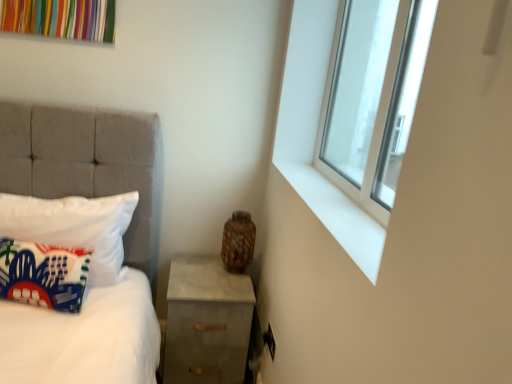
Question: Is clear glass window at upper right in front of or behind white fabric pillow at left, arranged as the second pillow when viewed from the front, in the image?

Choices:
 (A) front
 (B) behind

Answer: (A)

Question: In terms of width, does clear glass window at upper right look wider or thinner when compared to white fabric pillow at left, arranged as the second pillow when viewed from the front?

Choices:
 (A) thin
 (B) wide

Answer: (A)

Question: Which object is positioned farthest from the clear glass window at upper right?

Choices:
 (A) concrete nightstand at lower right
 (B) printed fabric pillow at left, the second pillow when ordered from back to front
 (C) white fabric pillow at left, which is the 1th pillow from back to front
 (D) brown textured vase at lower right
 (E) white smooth window sill at upper right

Answer: (B)

Question: Estimate the real-world distances between objects in this image. Which object is closer to the concrete nightstand at lower right?

Choices:
 (A) brown textured vase at lower right
 (B) white smooth window sill at upper right
 (C) printed fabric pillow at left, which is the 1th pillow in front-to-back order
 (D) clear glass window at upper right
 (E) white fabric pillow at left, which is the 1th pillow from back to front

Answer: (A)